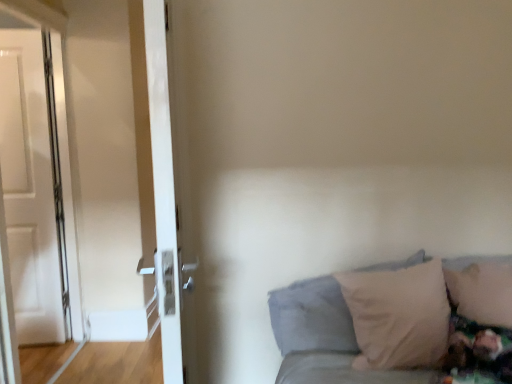
Question: From the image's perspective, is beige soft pillow at lower right, the second pillow positioned from the left, located above white glossy door at left, which ranks as the first door in right-to-left order?

Choices:
 (A) yes
 (B) no

Answer: (B)

Question: From a real-world perspective, is beige soft pillow at lower right, the second pillow positioned from the left, positioned over white glossy door at left, which ranks as the first door in right-to-left order, based on gravity?

Choices:
 (A) no
 (B) yes

Answer: (A)

Question: From a real-world perspective, does beige soft pillow at lower right, which is the first pillow from right to left, sit lower than white glossy door at left, which ranks as the second door in back-to-front order?

Choices:
 (A) yes
 (B) no

Answer: (A)

Question: Would you say beige soft pillow at lower right, the second pillow positioned from the left, is outside white glossy door at left, which ranks as the first door in right-to-left order?

Choices:
 (A) no
 (B) yes

Answer: (B)

Question: Can you confirm if beige soft pillow at lower right, which is the first pillow from right to left, is smaller than white glossy door at left, the 2th door when ordered from left to right?

Choices:
 (A) no
 (B) yes

Answer: (B)

Question: Considering the positions of white glossy door at left, placed as the 2th door when sorted from front to back, and white glossy door at left, the first door positioned from the front, in the image, is white glossy door at left, placed as the 2th door when sorted from front to back, wider or thinner than white glossy door at left, the first door positioned from the front,?

Choices:
 (A) wide
 (B) thin

Answer: (B)

Question: From the image's perspective, is white glossy door at left, the first door viewed from the left, above or below white glossy door at left, the first door positioned from the front?

Choices:
 (A) below
 (B) above

Answer: (B)

Question: In the image, is white glossy door at left, the 1th door viewed from the back, on the left side or the right side of white glossy door at left, the first door positioned from the front?

Choices:
 (A) left
 (B) right

Answer: (A)

Question: From a real-world perspective, is white glossy door at left, placed as the 2th door when sorted from front to back, physically located above or below white glossy door at left, which ranks as the first door in right-to-left order?

Choices:
 (A) below
 (B) above

Answer: (A)

Question: Is point (154, 125) positioned closer to the camera than point (473, 266)?

Choices:
 (A) farther
 (B) closer

Answer: (B)

Question: From the image's perspective, is white glossy door at left, which ranks as the second door in back-to-front order, located above or below beige soft pillow at lower right, the second pillow positioned from the left?

Choices:
 (A) above
 (B) below

Answer: (A)

Question: Do you think white glossy door at left, which ranks as the second door in back-to-front order, is within beige soft pillow at lower right, the second pillow positioned from the left, or outside of it?

Choices:
 (A) inside
 (B) outside

Answer: (B)

Question: In the image, is white glossy door at left, the first door positioned from the front, positioned in front of or behind beige soft pillow at lower right, which is the first pillow from right to left?

Choices:
 (A) front
 (B) behind

Answer: (A)

Question: Is beige soft pillow at lower right, the second pillow positioned from the left, taller or shorter than white glossy door at left, the 1th door viewed from the back?

Choices:
 (A) tall
 (B) short

Answer: (B)

Question: Looking at their shapes, would you say beige soft pillow at lower right, which is the first pillow from right to left, is wider or thinner than white glossy door at left, placed as the 2th door when sorted from front to back?

Choices:
 (A) wide
 (B) thin

Answer: (A)